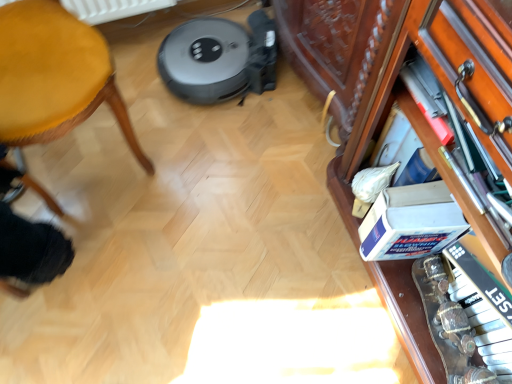
At what (x,y) coordinates should I click in order to perform the action: click on spots to the right of yellow fabric stool at left. Please return your answer as a coordinate pair (x, y). The image size is (512, 384). Looking at the image, I should click on (206, 166).